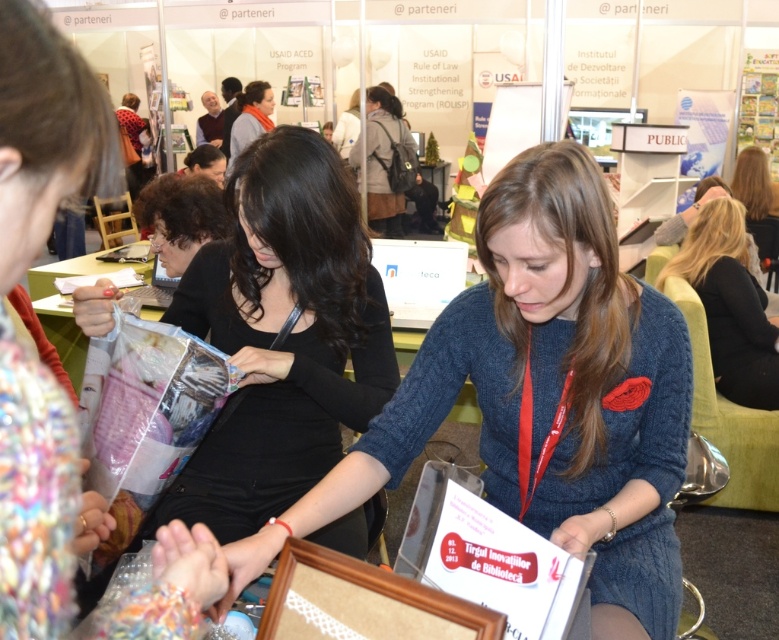
In the scene, there is a brown wooden picture frame at center and a person with blonde hair at right. Which object has a smaller width?

The brown wooden picture frame at center has a lesser width compared to the blonde hair at right.

You are an event planner arranging decorations for a booth. You have a brown wooden picture frame at center and a matte black scarf at upper center. According to the scene, which object is located to the right of the other?

The brown wooden picture frame at center is positioned on the right side of matte black scarf at upper center.